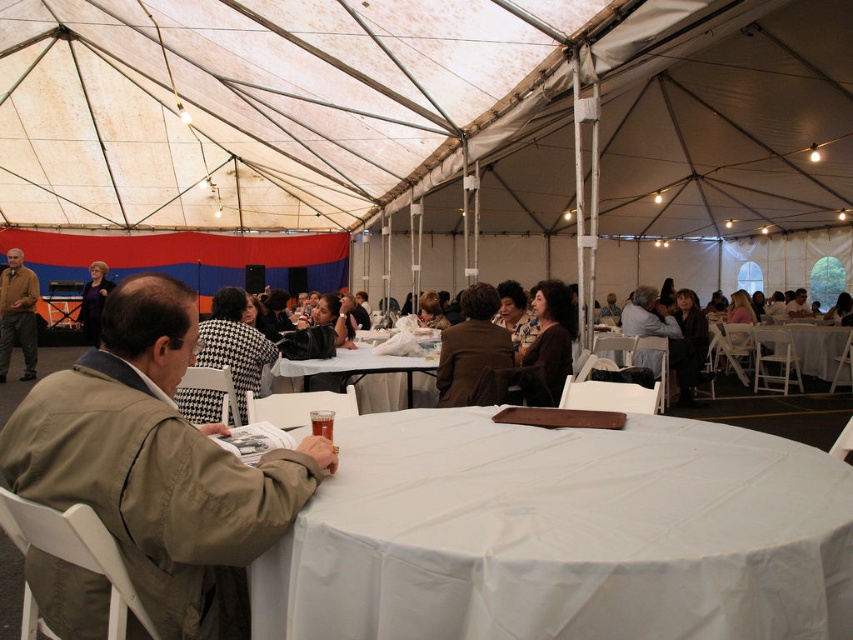
Question: Which of these objects is positioned farthest from the white plastic table at right?

Choices:
 (A) tan fabric jacket at left
 (B) white plastic table at center
 (C) brown leather jacket at left

Answer: (C)

Question: Which point is farther from the camera taking this photo?

Choices:
 (A) (114, 369)
 (B) (32, 292)
 (C) (820, 342)
 (D) (503, 356)

Answer: (C)

Question: Does white plastic table at center lie in front of white plastic table at right?

Choices:
 (A) no
 (B) yes

Answer: (B)

Question: Is white cloth at center wider than brown leather jacket at center?

Choices:
 (A) no
 (B) yes

Answer: (B)

Question: Which point is closer to the camera taking this photo?

Choices:
 (A) (91, 269)
 (B) (161, 348)
 (C) (384, 394)
 (D) (756, 332)

Answer: (B)

Question: Does white plastic table at center appear on the left side of white plastic table at right?

Choices:
 (A) no
 (B) yes

Answer: (B)